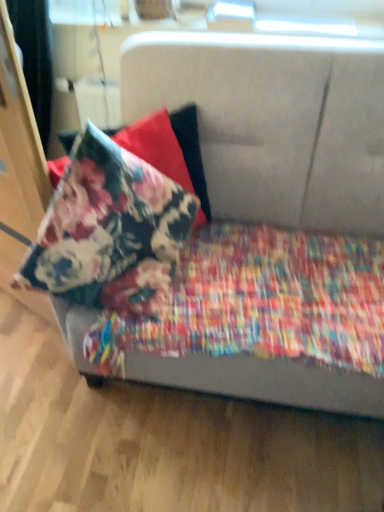
Question: Is floral fabric pillow at upper left situated inside floral cotton blanket at lower left or outside?

Choices:
 (A) outside
 (B) inside

Answer: (A)

Question: Considering the positions of floral fabric pillow at upper left and floral cotton blanket at lower left in the image, is floral fabric pillow at upper left taller or shorter than floral cotton blanket at lower left?

Choices:
 (A) short
 (B) tall

Answer: (B)

Question: Which object is the closest to the floral cotton blanket at lower left?

Choices:
 (A) textured fabric couch at center
 (B) floral fabric pillow at upper left

Answer: (B)

Question: Which object is positioned farthest from the floral cotton blanket at lower left?

Choices:
 (A) floral fabric pillow at upper left
 (B) textured fabric couch at center

Answer: (B)